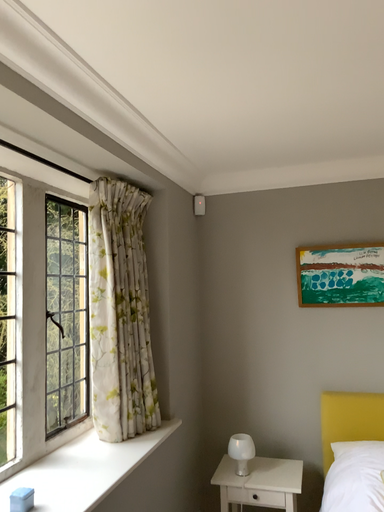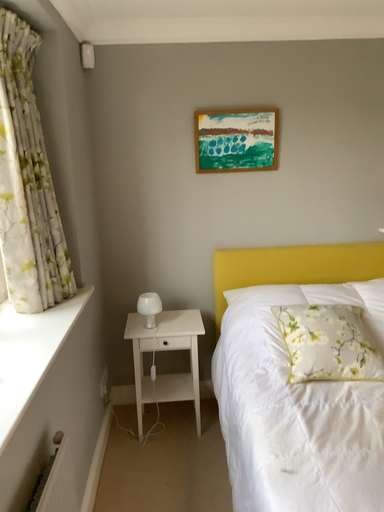
Question: How did the camera likely rotate when shooting the video?

Choices:
 (A) rotated downward
 (B) rotated upward

Answer: (A)